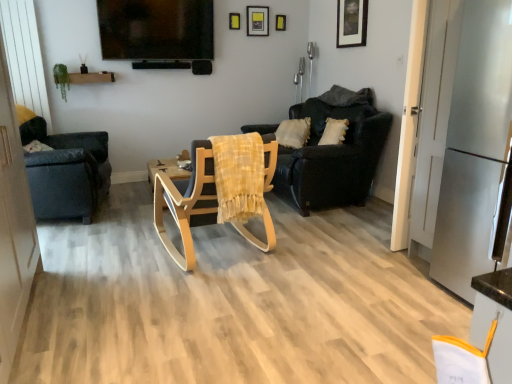
Question: Is dark gray fabric chair at left, placed as the 1th chair when sorted from left to right, aimed at wooden rocking chair at center, positioned as the second chair in right-to-left order?

Choices:
 (A) no
 (B) yes

Answer: (A)

Question: Does dark gray fabric chair at left, the third chair positioned from the right, lie behind wooden rocking chair at center, positioned as the second chair in right-to-left order?

Choices:
 (A) no
 (B) yes

Answer: (B)

Question: From a real-world perspective, is dark gray fabric chair at left, the third chair positioned from the right, located higher than wooden rocking chair at center, positioned as the second chair in right-to-left order?

Choices:
 (A) yes
 (B) no

Answer: (A)

Question: From the image's perspective, is dark gray fabric chair at left, the third chair positioned from the right, beneath wooden rocking chair at center, which appears as the second chair when viewed from the left?

Choices:
 (A) no
 (B) yes

Answer: (A)

Question: Is dark gray fabric chair at left, the third chair positioned from the right, outside wooden rocking chair at center, positioned as the second chair in right-to-left order?

Choices:
 (A) yes
 (B) no

Answer: (A)

Question: In terms of width, does satin silver refrigerator at right look wider or thinner when compared to dark brown leather armchair at center, which is the 1th chair in right-to-left order?

Choices:
 (A) wide
 (B) thin

Answer: (B)

Question: Considering their positions, is satin silver refrigerator at right located in front of or behind dark brown leather armchair at center, positioned as the 3th chair in left-to-right order?

Choices:
 (A) front
 (B) behind

Answer: (A)

Question: Considering the positions of satin silver refrigerator at right and dark brown leather armchair at center, positioned as the 3th chair in left-to-right order, in the image, is satin silver refrigerator at right taller or shorter than dark brown leather armchair at center, positioned as the 3th chair in left-to-right order,?

Choices:
 (A) short
 (B) tall

Answer: (B)

Question: Which is correct: satin silver refrigerator at right is inside dark brown leather armchair at center, which is the 1th chair in right-to-left order, or outside of it?

Choices:
 (A) inside
 (B) outside

Answer: (B)

Question: From the image's perspective, is matte black picture frame at upper right, which is the 4th picture frame in back-to-front order, located above or below wooden rocking chair at center, which appears as the second chair when viewed from the left?

Choices:
 (A) above
 (B) below

Answer: (A)

Question: From a real-world perspective, is matte black picture frame at upper right, which is counted as the 1th picture frame, starting from the right, positioned above or below wooden rocking chair at center, which appears as the second chair when viewed from the left?

Choices:
 (A) below
 (B) above

Answer: (B)

Question: In the image, is matte black picture frame at upper right, which appears as the fourth picture frame when viewed from the left, positioned in front of or behind wooden rocking chair at center, positioned as the second chair in right-to-left order?

Choices:
 (A) behind
 (B) front

Answer: (A)

Question: Considering the positions of matte black picture frame at upper right, which appears as the fourth picture frame when viewed from the left, and wooden rocking chair at center, which appears as the second chair when viewed from the left, in the image, is matte black picture frame at upper right, which appears as the fourth picture frame when viewed from the left, bigger or smaller than wooden rocking chair at center, which appears as the second chair when viewed from the left,?

Choices:
 (A) small
 (B) big

Answer: (A)

Question: Looking at their shapes, would you say matte yellow picture frame at upper center, which is the 1th picture frame in back-to-front order, is wider or thinner than dark brown leather armchair at center, which is the 1th chair in right-to-left order?

Choices:
 (A) wide
 (B) thin

Answer: (B)

Question: From a real-world perspective, is matte yellow picture frame at upper center, acting as the 3th picture frame starting from the left, positioned above or below dark brown leather armchair at center, positioned as the 3th chair in left-to-right order?

Choices:
 (A) above
 (B) below

Answer: (A)